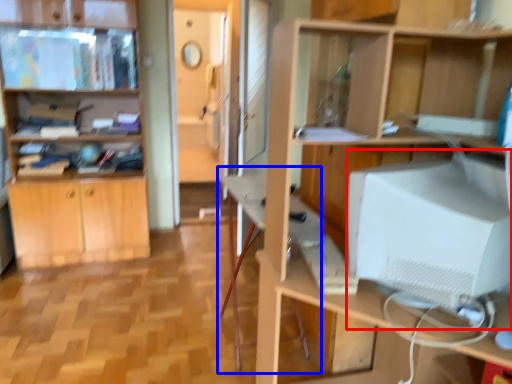
Question: Which point is closer to the camera, computer monitor (highlighted by a red box) or computer desk (highlighted by a blue box)?

Choices:
 (A) computer monitor
 (B) computer desk

Answer: (A)